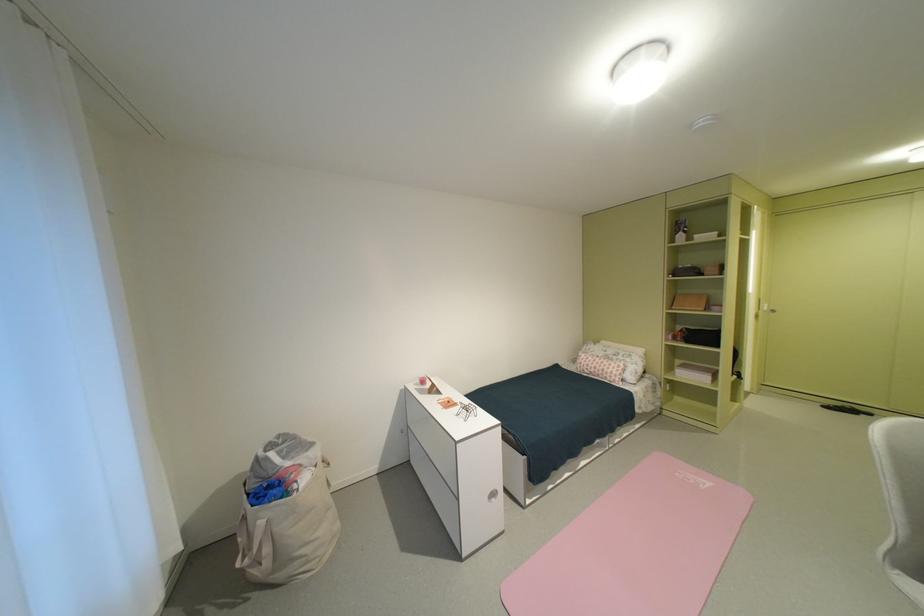
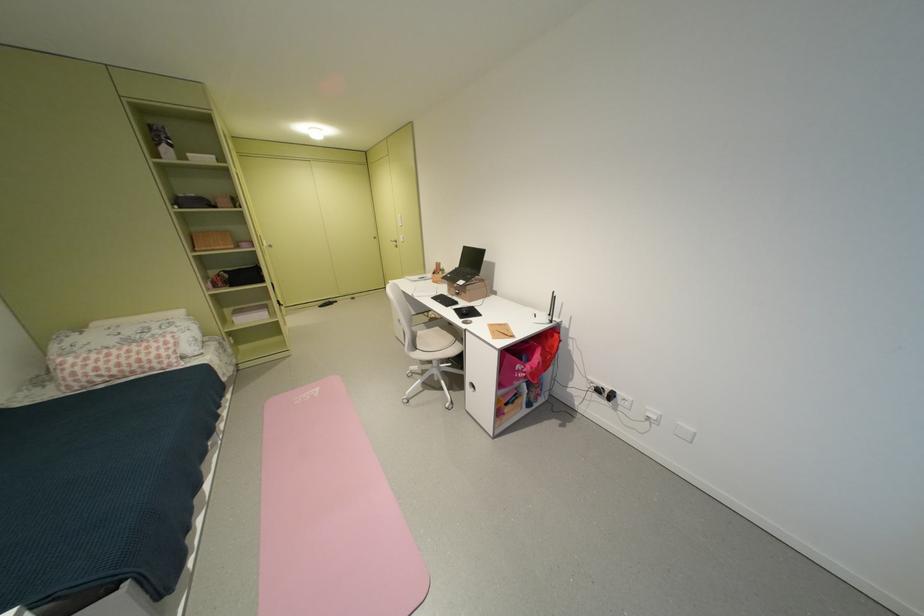
Locate, in the second image, the point that corresponds to (x=686, y=476) in the first image.

(305, 403)